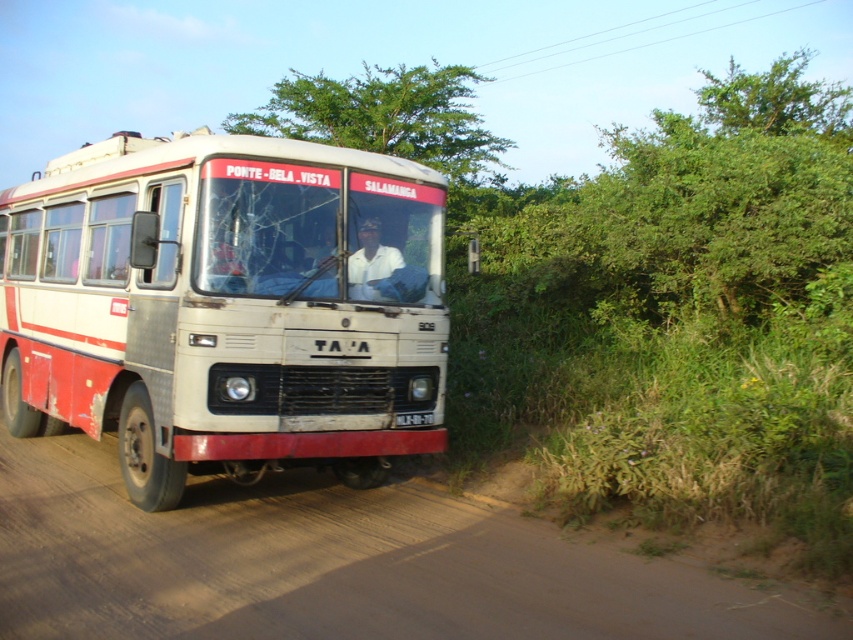
Question: Is the position of white matte bus at center more distant than that of black plastic license plate at center?

Choices:
 (A) yes
 (B) no

Answer: (B)

Question: Can you confirm if green leafy tree at upper center is thinner than black plastic license plate at center?

Choices:
 (A) yes
 (B) no

Answer: (B)

Question: Which of these objects is positioned farthest from the white matte shirt at center?

Choices:
 (A) green leafy tree at upper center
 (B) white matte bus at center
 (C) black plastic license plate at center
 (D) brown dirt track at lower center

Answer: (A)

Question: Is white matte bus at center positioned in front of green leafy tree at upper center?

Choices:
 (A) no
 (B) yes

Answer: (B)

Question: Among these points, which one is farthest from the camera?

Choices:
 (A) (167, 518)
 (B) (489, 176)
 (C) (378, 228)

Answer: (B)

Question: Which of the following is the farthest from the observer?

Choices:
 (A) (86, 586)
 (B) (404, 422)

Answer: (B)